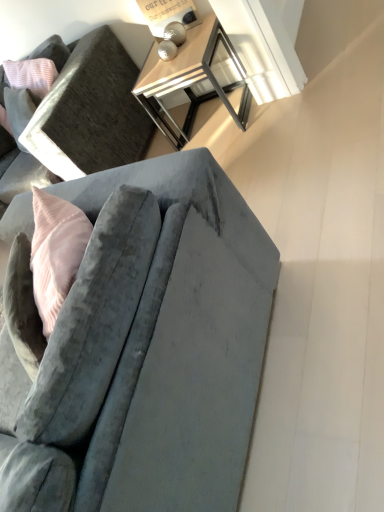
Question: Which direction should I rotate to face velvet gray couch at center, the second studio couch in the back-to-front sequence, — up or down?

Choices:
 (A) down
 (B) up

Answer: (A)

Question: Considering the relative sizes of metallic silver table at upper center and velvet gray couch at lower left, arranged as the 1th studio couch when viewed from the top, in the image provided, is metallic silver table at upper center shorter than velvet gray couch at lower left, arranged as the 1th studio couch when viewed from the top,?

Choices:
 (A) no
 (B) yes

Answer: (B)

Question: Is the position of metallic silver table at upper center more distant than that of velvet gray couch at lower left, which is counted as the 2th studio couch, starting from the front?

Choices:
 (A) yes
 (B) no

Answer: (A)

Question: Considering the relative sizes of metallic silver table at upper center and velvet gray couch at lower left, arranged as the 1th studio couch when viewed from the back, in the image provided, is metallic silver table at upper center wider than velvet gray couch at lower left, arranged as the 1th studio couch when viewed from the back,?

Choices:
 (A) yes
 (B) no

Answer: (B)

Question: Is metallic silver table at upper center positioned far away from velvet gray couch at lower left, which is counted as the 2th studio couch, starting from the front?

Choices:
 (A) yes
 (B) no

Answer: (B)

Question: Is metallic silver table at upper center facing towards velvet gray couch at lower left, the 2th studio couch in the bottom-to-top sequence?

Choices:
 (A) yes
 (B) no

Answer: (B)

Question: From a real-world perspective, does metallic silver table at upper center stand above velvet gray couch at lower left, arranged as the 1th studio couch when viewed from the top?

Choices:
 (A) no
 (B) yes

Answer: (A)

Question: From the image's perspective, is velvet gray couch at center, the 1th studio couch in the bottom-to-top sequence, located above metallic silver table lamp at upper center?

Choices:
 (A) no
 (B) yes

Answer: (A)

Question: Can you confirm if velvet gray couch at center, the second studio couch viewed from the top, is positioned to the left of metallic silver table lamp at upper center?

Choices:
 (A) yes
 (B) no

Answer: (A)

Question: Does velvet gray couch at center, the second studio couch in the back-to-front sequence, have a lesser width compared to metallic silver table lamp at upper center?

Choices:
 (A) no
 (B) yes

Answer: (A)

Question: From a real-world perspective, is velvet gray couch at center, the second studio couch in the back-to-front sequence, physically below metallic silver table lamp at upper center?

Choices:
 (A) yes
 (B) no

Answer: (A)

Question: Is metallic silver table lamp at upper center located within velvet gray couch at center, the second studio couch viewed from the top?

Choices:
 (A) no
 (B) yes

Answer: (A)

Question: Can you confirm if velvet gray couch at center, the second studio couch in the back-to-front sequence, is wider than metallic silver table lamp at upper center?

Choices:
 (A) no
 (B) yes

Answer: (B)

Question: Is velvet gray couch at lower left, arranged as the 1th studio couch when viewed from the back, not within metallic silver table lamp at upper center?

Choices:
 (A) yes
 (B) no

Answer: (A)